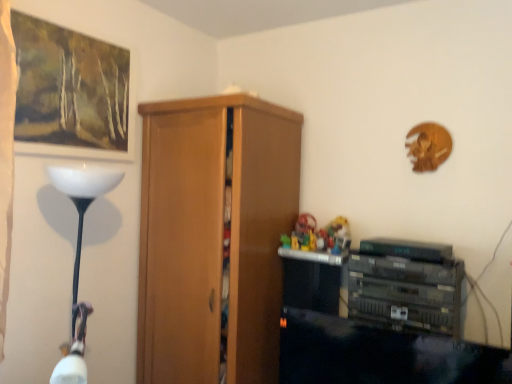
Describe the element at coordinates (318, 235) in the screenshot. I see `multicolored plastic toys at center` at that location.

Identify the location of matte wooden picture frame at upper left. (70, 93).

Find the location of `multicolored plastic toys at center`. multicolored plastic toys at center is located at coordinates (318, 235).

Is matte wooden picture frame at upper left oriented towards wooden cupboard at center?

No, matte wooden picture frame at upper left is not turned towards wooden cupboard at center.

Is the depth of matte wooden picture frame at upper left less than that of wooden cupboard at center?

Yes, it is in front of wooden cupboard at center.

Does matte wooden picture frame at upper left have a lesser height compared to wooden cupboard at center?

Yes, matte wooden picture frame at upper left is shorter than wooden cupboard at center.

Measure the distance from matte wooden picture frame at upper left to wooden cupboard at center.

The distance of matte wooden picture frame at upper left from wooden cupboard at center is 22.52 inches.

From the image's perspective, does multicolored plastic toys at center appear lower than matte wooden picture frame at upper left?

Yes, from the image's perspective, multicolored plastic toys at center is below matte wooden picture frame at upper left.

Does multicolored plastic toys at center have a larger size compared to matte wooden picture frame at upper left?

Actually, multicolored plastic toys at center might be smaller than matte wooden picture frame at upper left.

Is multicolored plastic toys at center positioned before matte wooden picture frame at upper left?

No, multicolored plastic toys at center is further to the viewer.

Based on the photo, is multicolored plastic toys at center situated inside matte wooden picture frame at upper left or outside?

multicolored plastic toys at center is spatially situated outside matte wooden picture frame at upper left.

Which object is positioned more to the left, wooden cupboard at center or matte wooden picture frame at upper left?

From the viewer's perspective, matte wooden picture frame at upper left appears more on the left side.

Between wooden cupboard at center and matte wooden picture frame at upper left, which one has smaller width?

Thinner between the two is matte wooden picture frame at upper left.

This screenshot has width=512, height=384. Find the location of `picture frame located above the wooden cupboard at center (from a real-world perspective)`. picture frame located above the wooden cupboard at center (from a real-world perspective) is located at coordinates (70, 93).

At what (x,y) coordinates should I click in order to perform the action: click on toy located above the wooden cupboard at center (from the image's perspective). Please return your answer as a coordinate pair (x, y). This screenshot has width=512, height=384. Looking at the image, I should click on (318, 235).

From the image's perspective, who appears lower, multicolored plastic toys at center or wooden cupboard at center?

From the image's view, wooden cupboard at center is below.

Considering the relative positions of multicolored plastic toys at center and wooden cupboard at center in the image provided, is multicolored plastic toys at center in front of wooden cupboard at center?

That is False.

Is multicolored plastic toys at center facing towards wooden cupboard at center?

No.

From the image's perspective, is wooden cupboard at center on top of multicolored plastic toys at center?

Incorrect, from the image's perspective, wooden cupboard at center is lower than multicolored plastic toys at center.

In the image, is wooden cupboard at center positioned in front of or behind multicolored plastic toys at center?

wooden cupboard at center is in front of multicolored plastic toys at center.

Considering the relative positions of wooden cupboard at center and multicolored plastic toys at center in the image provided, is wooden cupboard at center to the right of multicolored plastic toys at center from the viewer's perspective?

No, wooden cupboard at center is not to the right of multicolored plastic toys at center.

Is multicolored plastic toys at center inside wooden cupboard at center?

No, wooden cupboard at center does not contain multicolored plastic toys at center.

Is matte wooden picture frame at upper left not near multicolored plastic toys at center?

Yes, matte wooden picture frame at upper left is far from multicolored plastic toys at center.

Where is `toy behind the matte wooden picture frame at upper left`? This screenshot has width=512, height=384. toy behind the matte wooden picture frame at upper left is located at coordinates (318, 235).

From the image's perspective, is matte wooden picture frame at upper left above multicolored plastic toys at center?

Correct, matte wooden picture frame at upper left appears higher than multicolored plastic toys at center in the image.

Is matte wooden picture frame at upper left thinner than multicolored plastic toys at center?

Correct, the width of matte wooden picture frame at upper left is less than that of multicolored plastic toys at center.

The width and height of the screenshot is (512, 384). I want to click on cupboard lying behind the matte wooden picture frame at upper left, so click(214, 236).

Locate an element on the screen. This screenshot has height=384, width=512. picture frame in front of the multicolored plastic toys at center is located at coordinates (70, 93).

Looking at this image, when comparing their distances from wooden cupboard at center, does multicolored plastic toys at center or matte wooden picture frame at upper left seem further?

Among the two, matte wooden picture frame at upper left is located further to wooden cupboard at center.

Estimate the real-world distances between objects in this image. Which object is closer to matte wooden picture frame at upper left, multicolored plastic toys at center or wooden cupboard at center?

wooden cupboard at center.

Estimate the real-world distances between objects in this image. Which object is closer to multicolored plastic toys at center, matte wooden picture frame at upper left or wooden cupboard at center?

The object closer to multicolored plastic toys at center is wooden cupboard at center.

Based on their spatial positions, is wooden cupboard at center or multicolored plastic toys at center further from matte wooden picture frame at upper left?

Among the two, multicolored plastic toys at center is located further to matte wooden picture frame at upper left.

From the picture: Considering their positions, is matte wooden picture frame at upper left positioned closer to wooden cupboard at center than multicolored plastic toys at center?

multicolored plastic toys at center lies closer to wooden cupboard at center than the other object.

From the image, which object appears to be nearer to multicolored plastic toys at center, wooden cupboard at center or matte wooden picture frame at upper left?

The object closer to multicolored plastic toys at center is wooden cupboard at center.

Identify the location of cupboard between matte wooden picture frame at upper left and multicolored plastic toys at center in the horizontal direction. This screenshot has height=384, width=512. (214, 236).